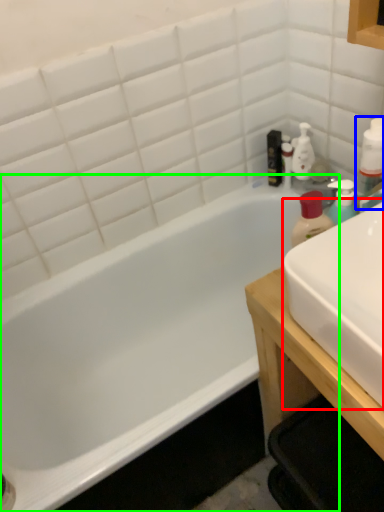
Question: Based on their relative distances, which object is farther from sink (highlighted by a red box)? Choose from bottle (highlighted by a blue box) and bathtub (highlighted by a green box).

Choices:
 (A) bottle
 (B) bathtub

Answer: (B)